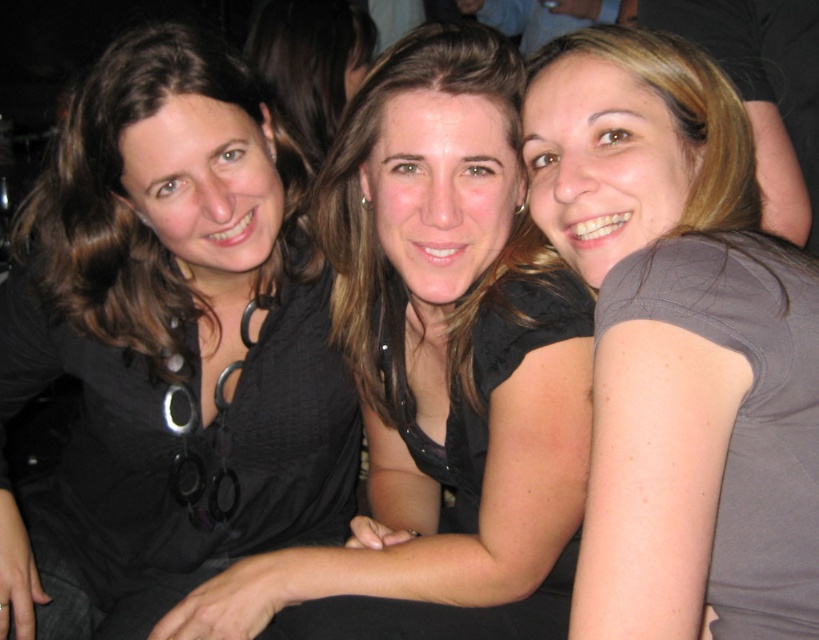
You are a photographer trying to place a small accessory exactly at the point marked by coordinates point (x=168, y=342). Based on the scene description, where would this accessory be placed in relation to the woman on the left?

The point (x=168, y=342) is on black matte fabric at left, which is part of the woman on the left wearing a black top. Therefore, the accessory would be placed on her black top.